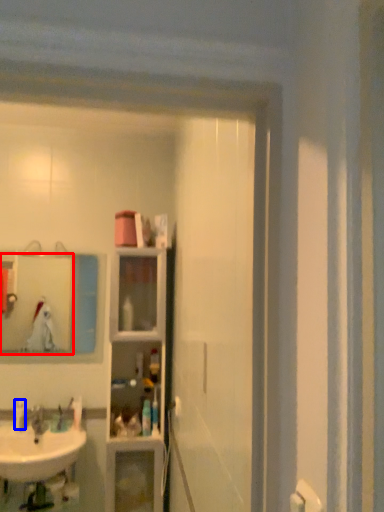
Question: Which of the following is the farthest to the observer, mirror (highlighted by a red box) or toiletry (highlighted by a blue box)?

Choices:
 (A) mirror
 (B) toiletry

Answer: (A)